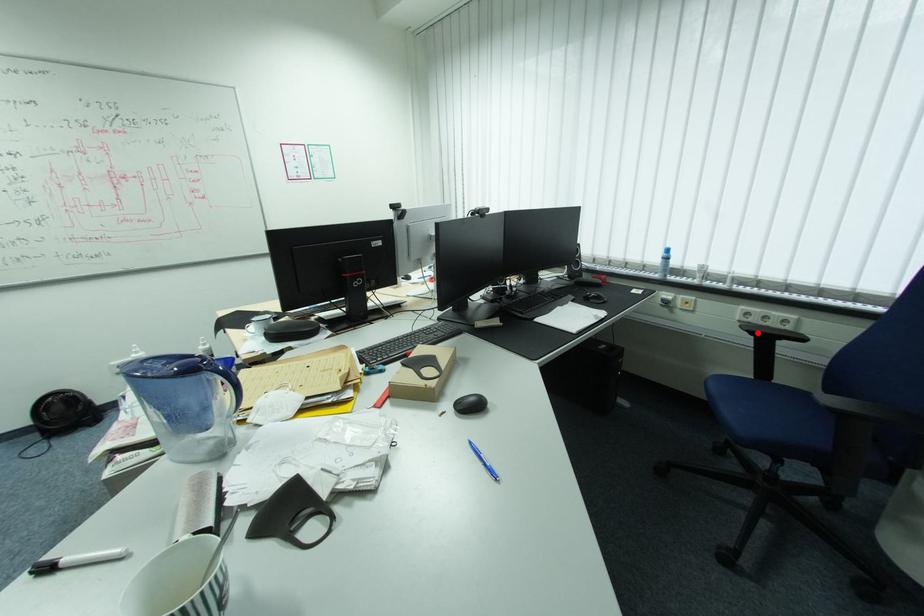
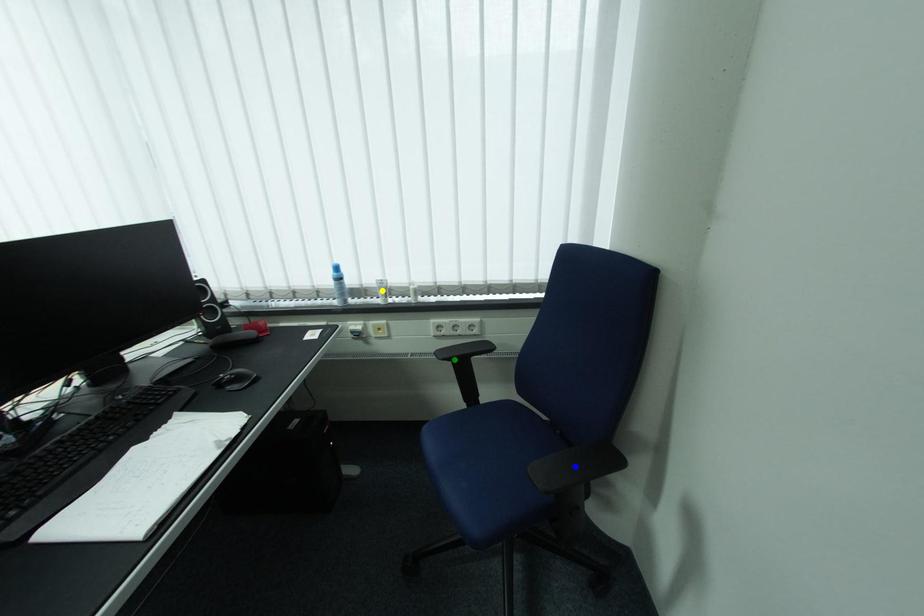
Question: I am providing you with two images of the same scene from different viewpoints. A red point is marked on the first image. You are given multiple points on the second image. In image 2, which mark is for the same physical point as the one in image 1?

Choices:
 (A) green point
 (B) yellow point
 (C) blue point

Answer: (A)